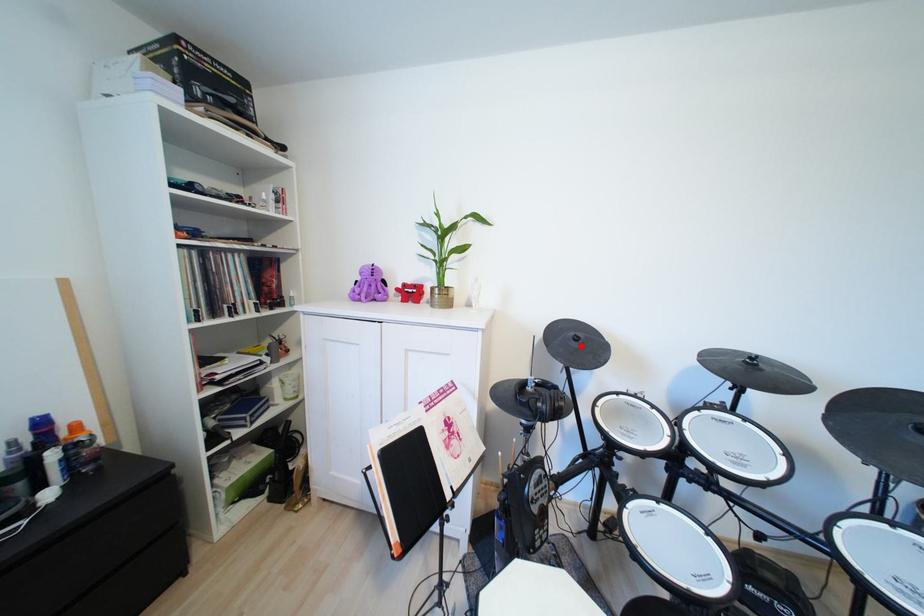
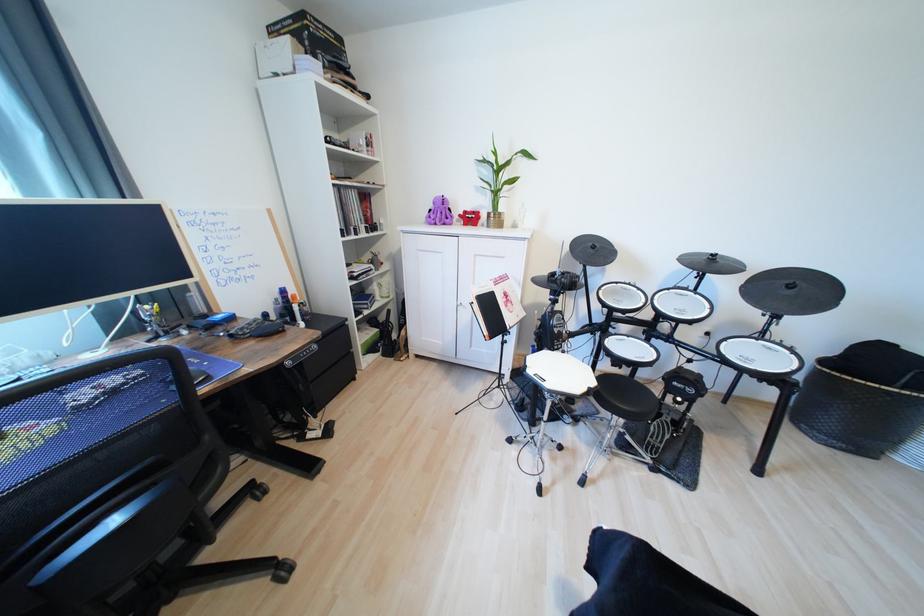
Find the pixel in the second image that matches the highlighted location in the first image.

(599, 252)